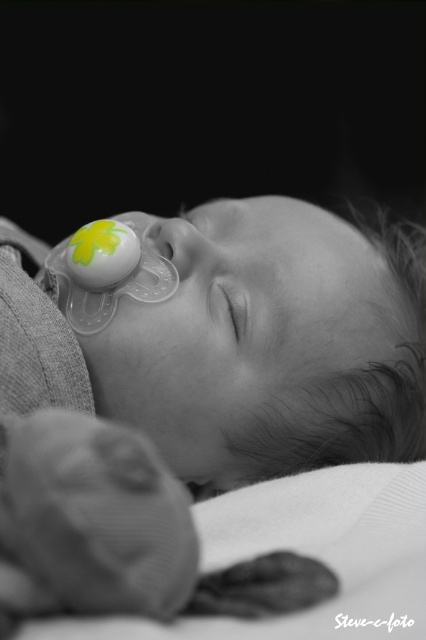
Question: Which point is closer to the camera?

Choices:
 (A) (83, 321)
 (B) (115, 536)

Answer: (B)

Question: Which object appears closest to the camera in this image?

Choices:
 (A) transparent plastic pacifier at upper left
 (B) transparent pacifier at center

Answer: (B)

Question: Can you confirm if transparent pacifier at center is positioned below transparent plastic pacifier at upper left?

Choices:
 (A) yes
 (B) no

Answer: (A)

Question: Which point appears farthest from the camera in this image?

Choices:
 (A) (186, 422)
 (B) (163, 278)

Answer: (B)

Question: Does transparent pacifier at center have a greater width compared to transparent plastic pacifier at upper left?

Choices:
 (A) yes
 (B) no

Answer: (A)

Question: Is transparent pacifier at center wider than transparent plastic pacifier at upper left?

Choices:
 (A) no
 (B) yes

Answer: (B)